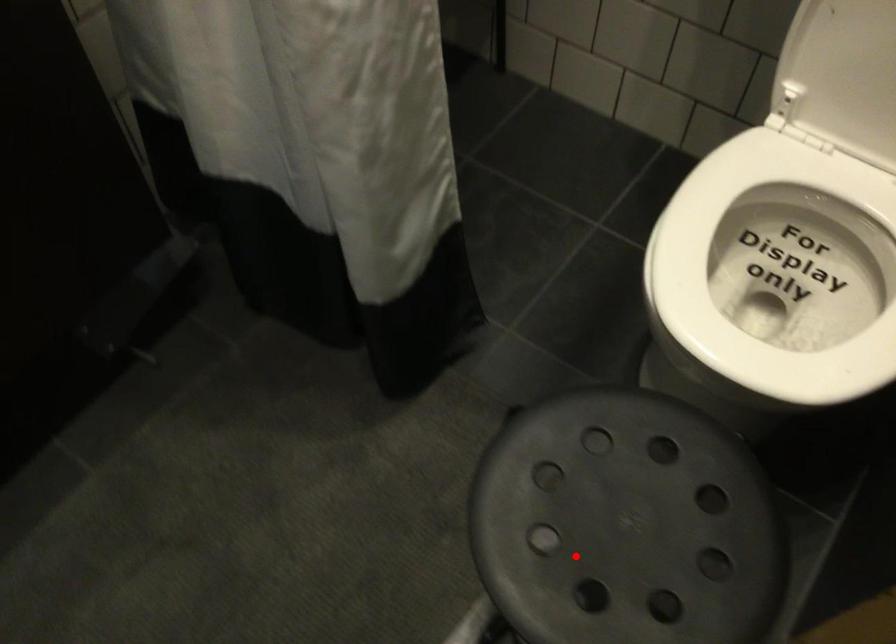
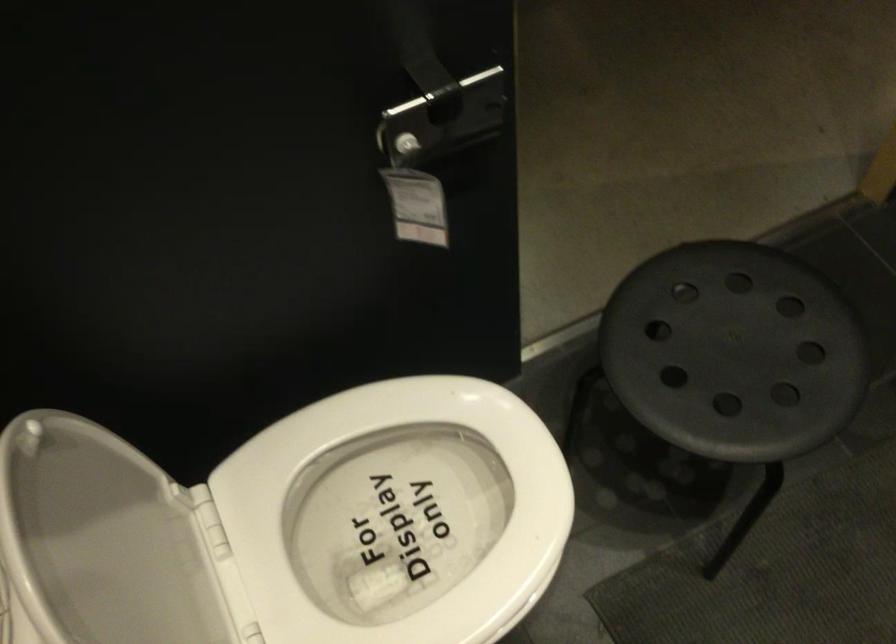
The point at the highlighted location is marked in the first image. Where is the corresponding point in the second image?

(734, 351)